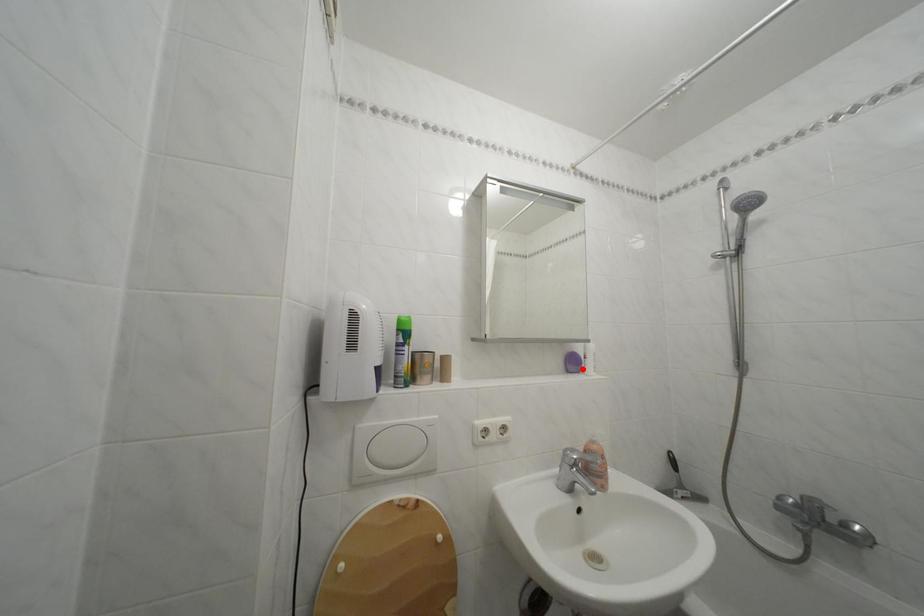
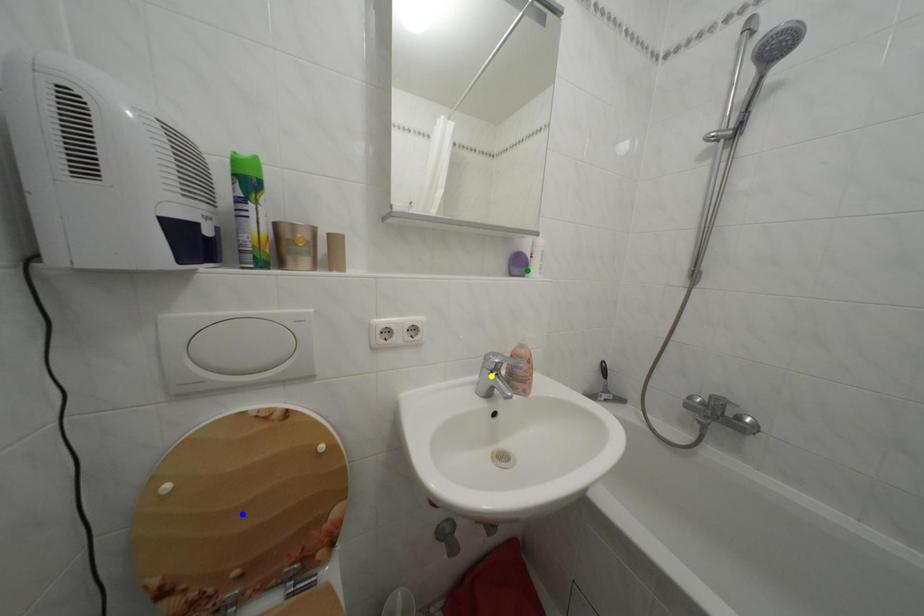
Question: I am providing you with two images of the same scene from different viewpoints. A red point is marked on the first image. You are given multiple points on the second image. Which spot in image 2 lines up with the point in image 1?

Choices:
 (A) yellow point
 (B) green point
 (C) blue point

Answer: (B)